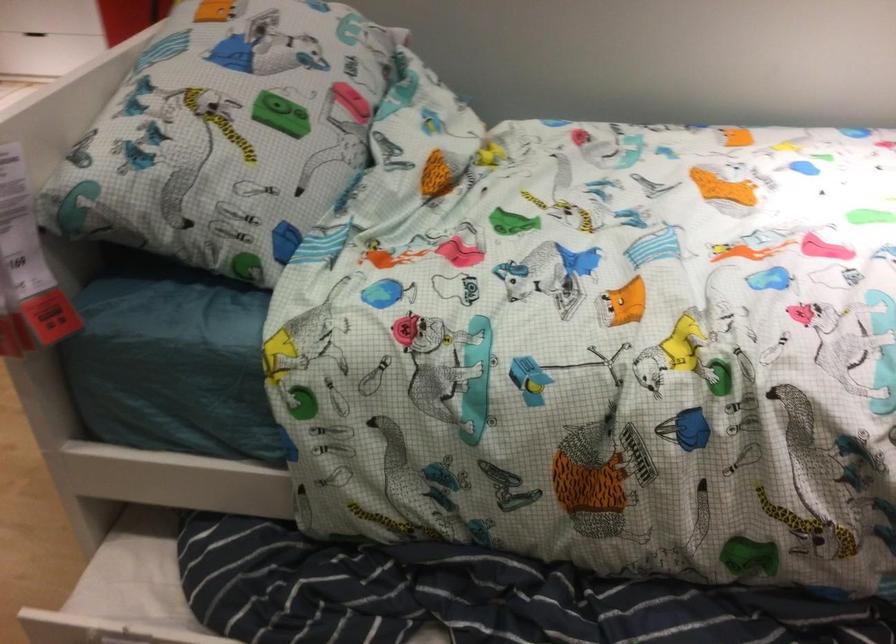
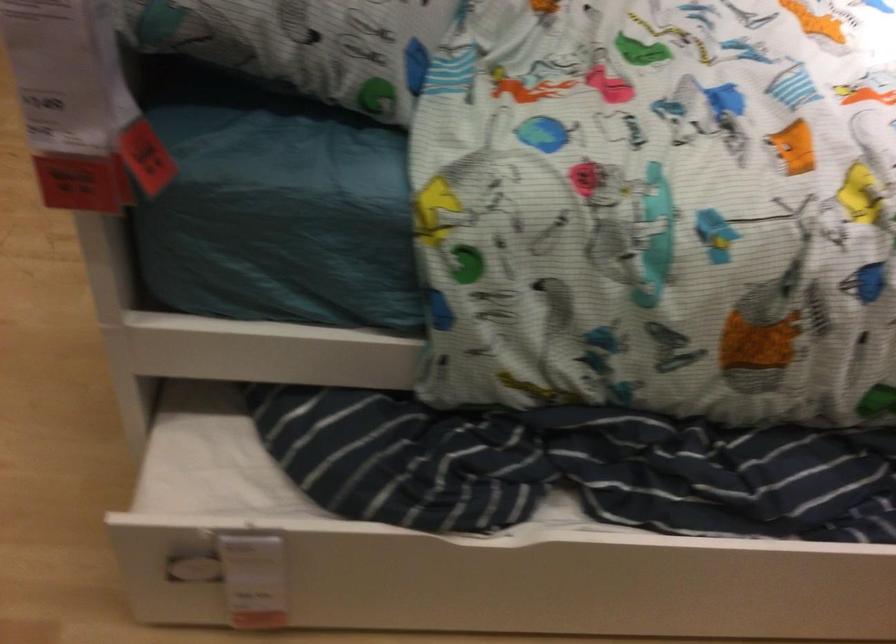
Question: The first image is from the beginning of the video and the second image is from the end. How did the camera likely rotate when shooting the video?

Choices:
 (A) Left
 (B) Right
 (C) Up
 (D) Down

Answer: (B)